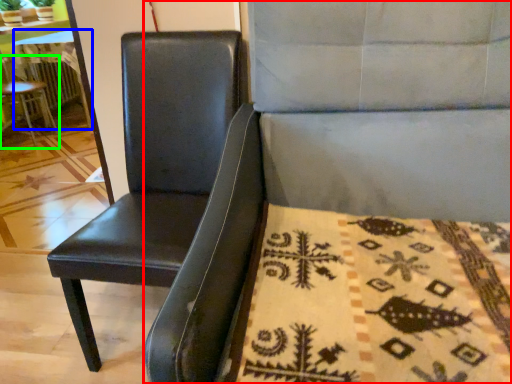
Question: Considering the real-world distances, which object is farthest from chair (highlighted by a red box)? table (highlighted by a blue box) or chair (highlighted by a green box)?

Choices:
 (A) table
 (B) chair

Answer: (A)